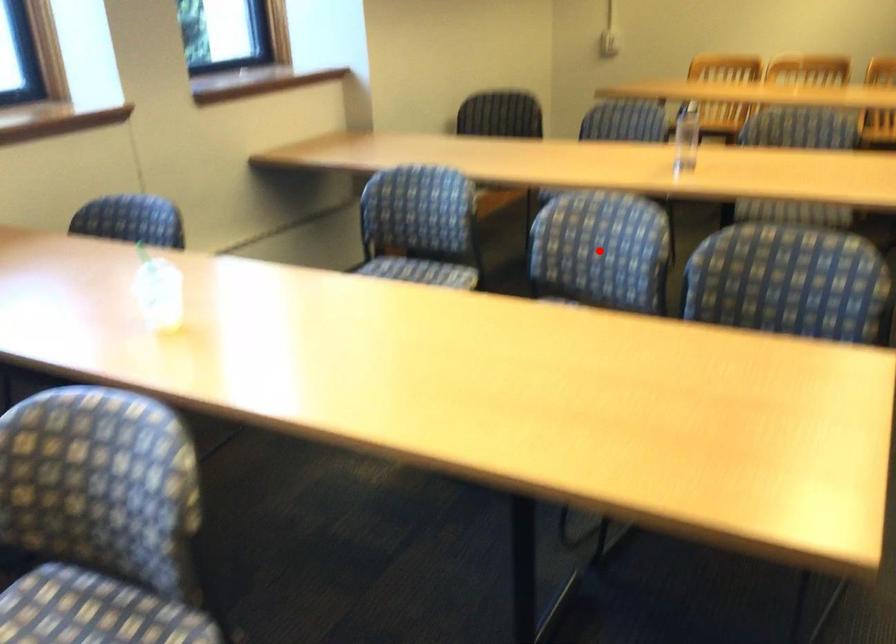
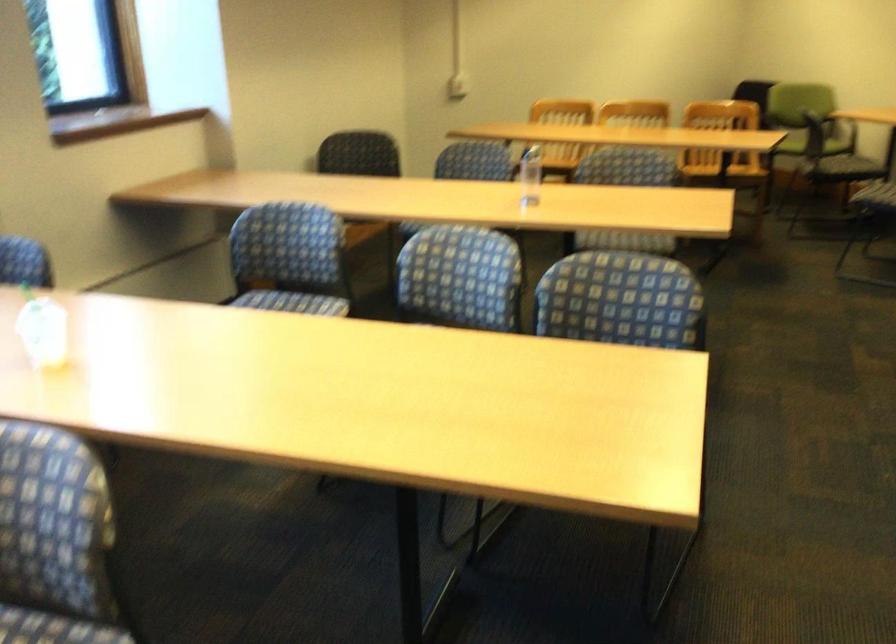
Locate, in the second image, the point that corresponds to the highlighted location in the first image.

(460, 277)